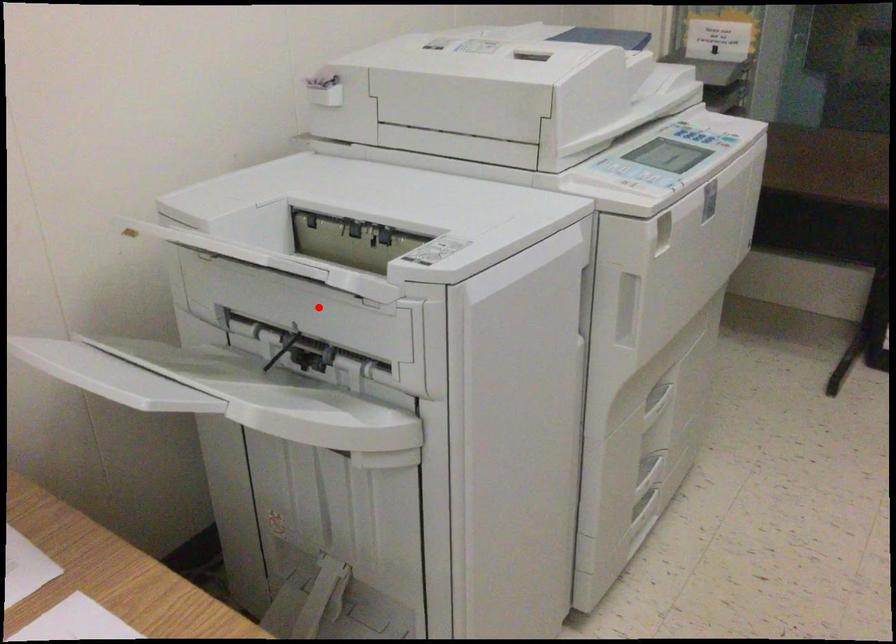
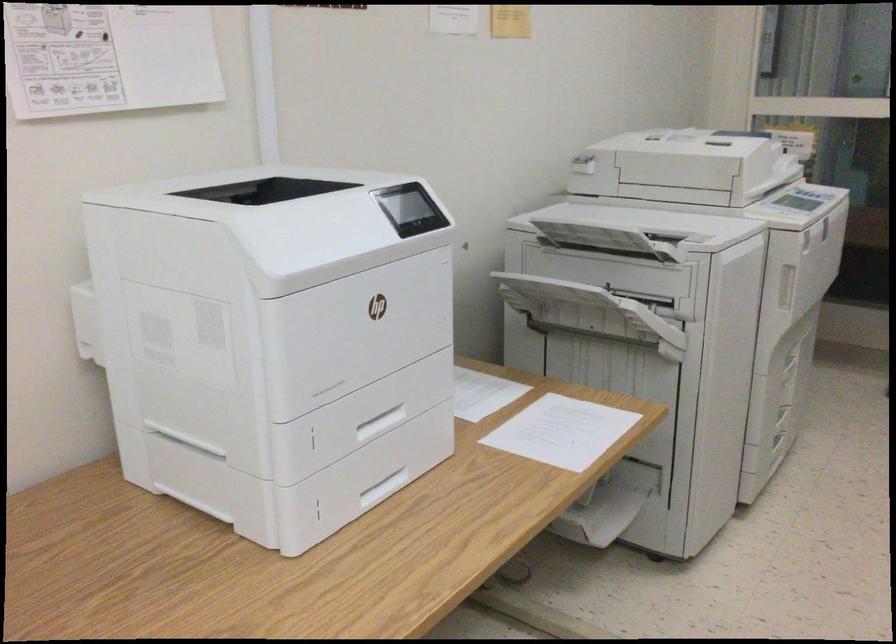
Where in the second image is the point corresponding to the highlighted location from the first image?

(623, 270)